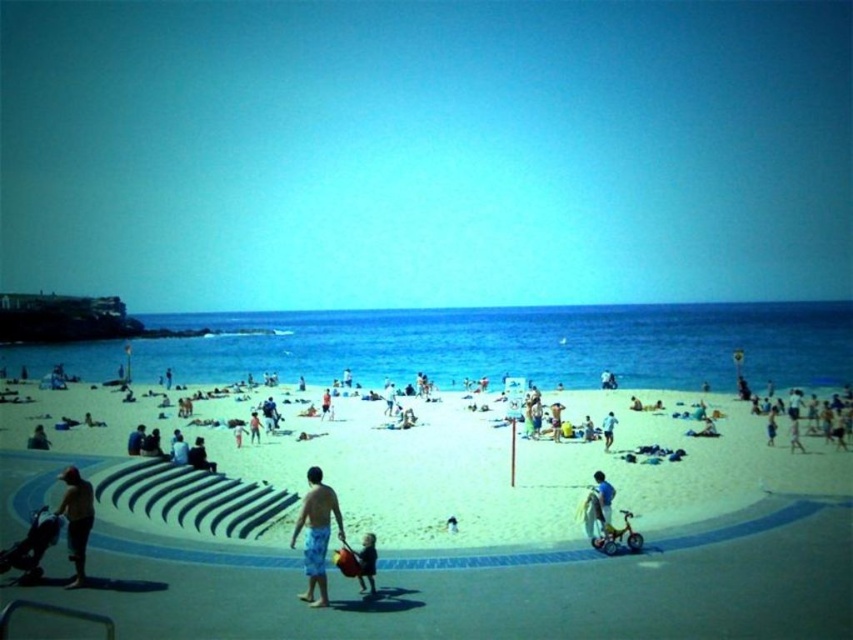
Measure the distance between matte black shorts at lower left and light blue fabric at lower right.

matte black shorts at lower left and light blue fabric at lower right are 10.96 meters apart from each other.

Locate an element on the screen. matte black shorts at lower left is located at coordinates (76, 518).

Is point (70, 552) positioned before point (602, 488)?

Yes.

Find the location of a particular element. matte black shorts at lower left is located at coordinates (76, 518).

Can you confirm if tan fabric bag at center is bigger than light blue fabric at lower right?

No, tan fabric bag at center is not bigger than light blue fabric at lower right.

Does point (374, 573) lie in front of point (596, 481)?

Yes, point (374, 573) is in front of point (596, 481).

Is point (370, 548) less distant than point (599, 499)?

Yes.

You are a GUI agent. You are given a task and a screenshot of the screen. Output one action in this format:
    pyautogui.click(x=<x>, y=<y>)
    Task: Click on the tan fabric bag at center
    
    Given the screenshot: What is the action you would take?
    pyautogui.click(x=361, y=563)

Is blue striped shorts at center thinner than light blue fabric at lower right?

Yes.

Who is higher up, blue striped shorts at center or light blue fabric at lower right?

light blue fabric at lower right is higher up.

Is point (309, 593) closer to camera compared to point (611, 490)?

Yes, it is.

Where is `blue striped shorts at center`? blue striped shorts at center is located at coordinates (316, 532).